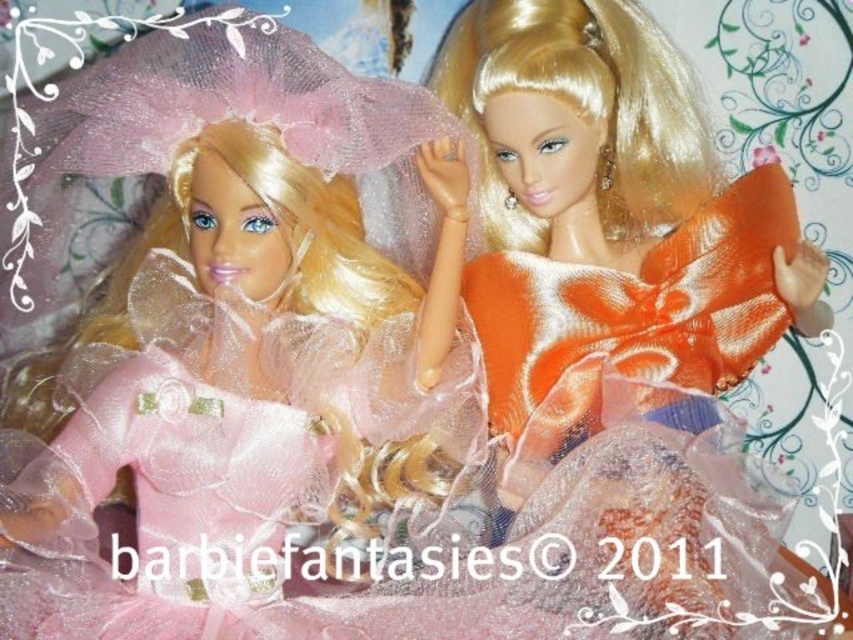
You are a photographer setting up a shoot. You need to position a spotlight so it shines directly on both the matte pink tulle dress at left and the orange satin dress at upper right. Since the spotlight can only illuminate a straight path, which dress should you place closer to the center to ensure both are equally lit?

You should place the matte pink tulle dress at left closer to the center because it is to the left of the orange satin dress at upper right, so moving it towards the center will balance their distance from the spotlight.

You are a photographer setting up a shoot for these two dolls. You need to adjust the lighting so that the matte pink tulle dress at left and the orange satin dress at upper right are both well illuminated. Considering their positions, which dress might require a closer light source to ensure it is properly lit?

The matte pink tulle dress at left is closer to the viewer than the orange satin dress at upper right, so it would require a closer light source to ensure proper illumination.